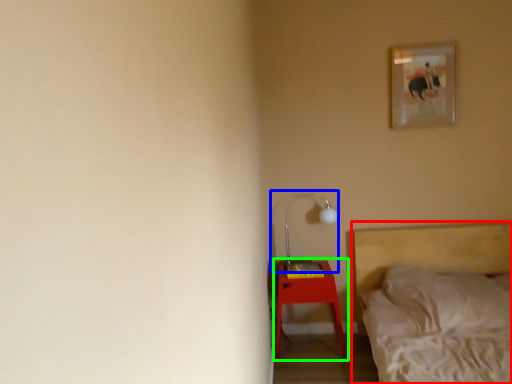
Question: Which object is positioned closest to bed (highlighted by a red box)? Select from table lamp (highlighted by a blue box) and nightstand (highlighted by a green box).

Choices:
 (A) table lamp
 (B) nightstand

Answer: (B)